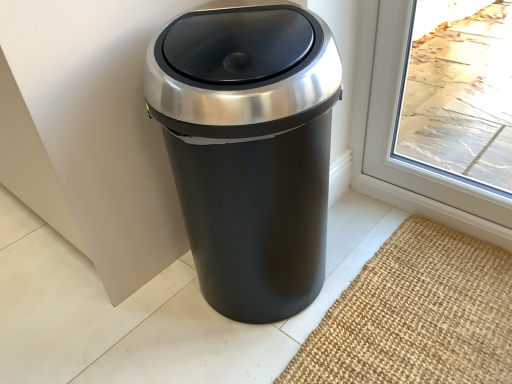
This screenshot has height=384, width=512. What do you see at coordinates (249, 149) in the screenshot?
I see `matte black trash can at center` at bounding box center [249, 149].

Where is `matte black trash can at center`? This screenshot has height=384, width=512. matte black trash can at center is located at coordinates (249, 149).

I want to click on matte black trash can at center, so click(249, 149).